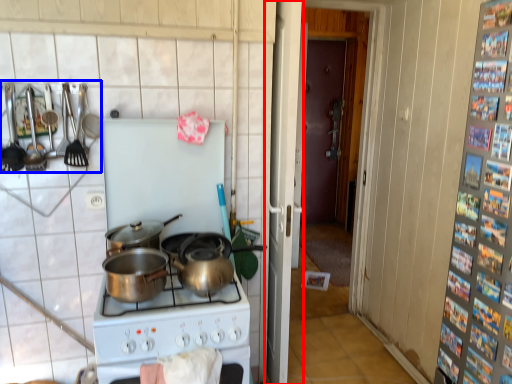
Question: Which of the following is the closest to the observer, screen door (highlighted by a red box) or kitchen appliance (highlighted by a blue box)?

Choices:
 (A) screen door
 (B) kitchen appliance

Answer: (B)